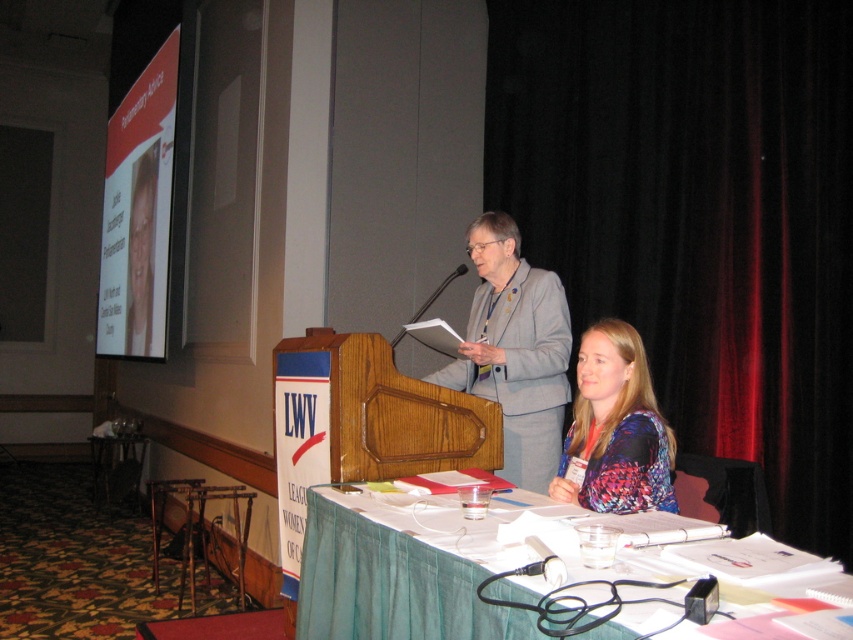
You are an event photographer at the LWV conference. You need to capture a photo that includes both the black velvet curtain at upper right and the white glossy projector screen at upper left. Based on their positions, which object should be on the left side of your photo?

The white glossy projector screen at upper left should be on the left side of the photo because the black velvet curtain at upper right is positioned to the right of it.

You are attending this event and need to place a name tag on the closest object to you between the green fabric table at lower center and the gray fabric suit at center. Which object should you choose?

The green fabric table at lower center is closer to the viewer than the gray fabric suit at center, so you should place the name tag on the green fabric table at lower center.